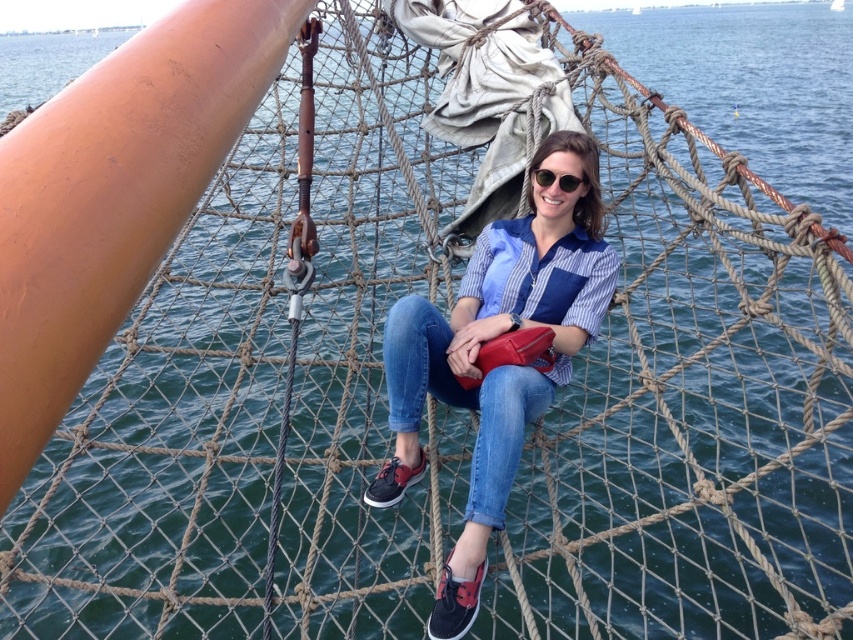
You are a photographer trying to capture the person sitting on the netted structure. You want to ensure the blue denim jeans at center are clearly visible in the photo. Based on their position, where should you aim your camera?

To ensure the blue denim jeans at center are clearly visible, aim your camera at point (498, 365) where the blue denim jeans at center are located.

You are a photographer trying to capture a candid shot of the person in the scene. You notice the blue denim jeans at center and the sunglasses at center. Which object should you focus on first if you want to capture the one that is taller?

The blue denim jeans at center is taller than the sunglasses at center, so you should focus on the blue denim jeans at center first.

You are trying to determine if the blue denim jeans at center can fit into a storage compartment that is the same width as the sunglasses at center. Based on the scene, will they fit?

The blue denim jeans at center are wider than the sunglasses at center, so they will not fit into the storage compartment designed for the sunglasses at center.